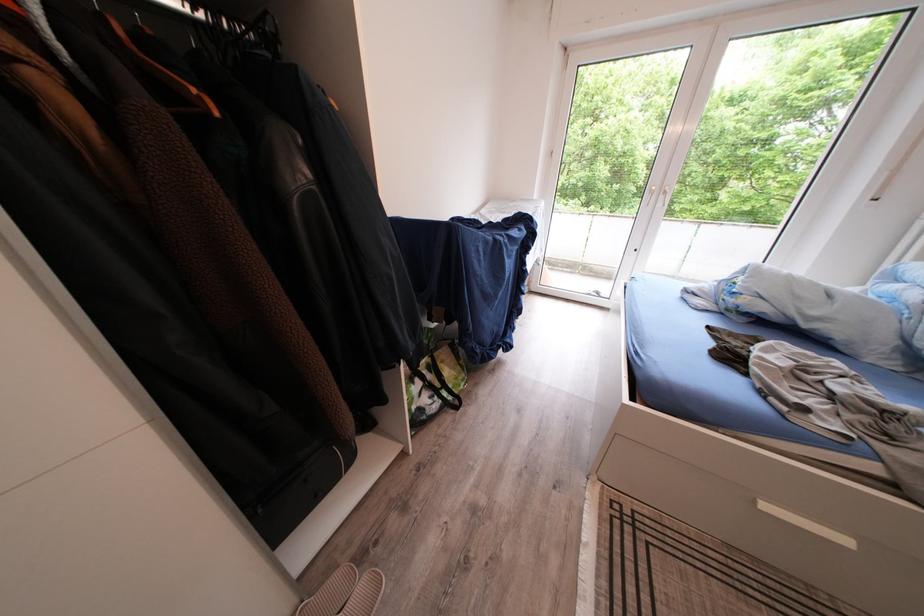
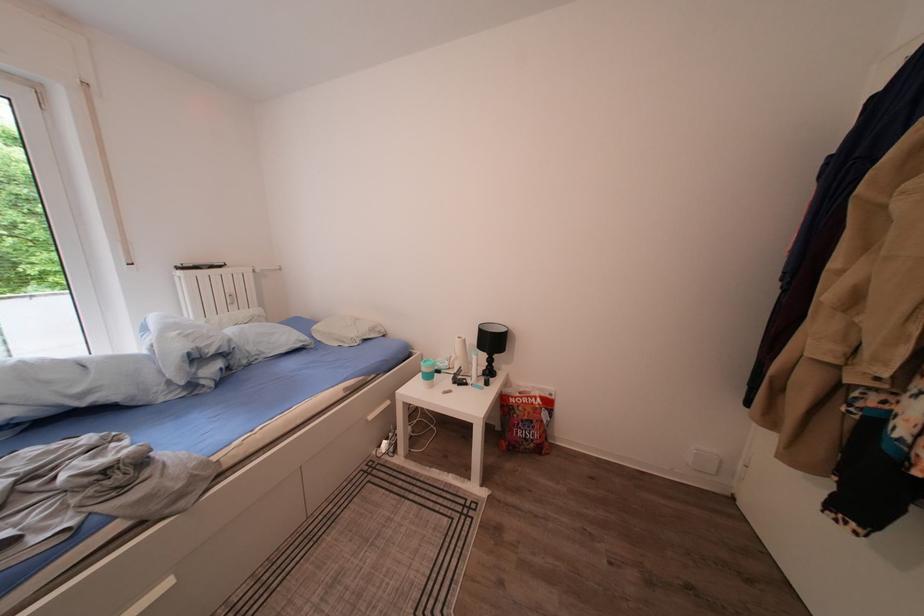
In the scene shown: First-person continuous shooting, in which direction is the camera rotating?

The camera's rotation is toward right-down.